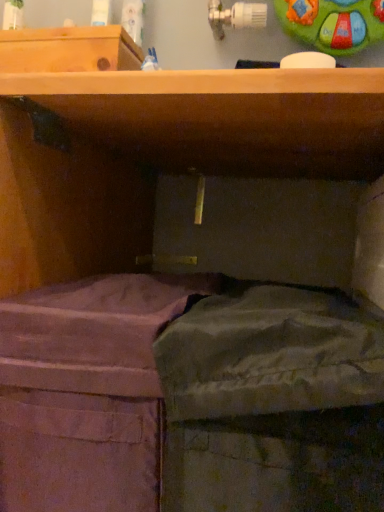
This screenshot has height=512, width=384. Describe the element at coordinates (86, 391) in the screenshot. I see `pink fabric at lower left, the 2th wide viewed from the right` at that location.

Find the location of a particular element. pink fabric at lower left, the 2th wide viewed from the right is located at coordinates (86, 391).

Where is `green crumpled paper at lower right, the first wide in the right-to-left sequence`? This screenshot has height=512, width=384. green crumpled paper at lower right, the first wide in the right-to-left sequence is located at coordinates (272, 404).

Image resolution: width=384 pixels, height=512 pixels. What do you see at coordinates (272, 404) in the screenshot?
I see `green crumpled paper at lower right, which is the 2th wide in left-to-right order` at bounding box center [272, 404].

Locate an element on the screen. The image size is (384, 512). pink fabric at lower left, the 2th wide viewed from the right is located at coordinates (86, 391).

Which object is positioned more to the right, green crumpled paper at lower right, which is the 2th wide in left-to-right order, or pink fabric at lower left, which is the 1th wide from left to right?

Positioned to the right is green crumpled paper at lower right, which is the 2th wide in left-to-right order.

Looking at this image, which object is further away from the camera, green crumpled paper at lower right, the first wide in the right-to-left sequence, or pink fabric at lower left, the 2th wide viewed from the right?

pink fabric at lower left, the 2th wide viewed from the right, is further away from the camera.

Is point (264, 416) farther from camera compared to point (138, 381)?

No.

From the image's perspective, would you say green crumpled paper at lower right, which is the 2th wide in left-to-right order, is positioned over pink fabric at lower left, which is the 1th wide from left to right?

Yes, from the image's perspective, green crumpled paper at lower right, which is the 2th wide in left-to-right order, is on top of pink fabric at lower left, which is the 1th wide from left to right.

From a real-world perspective, is green crumpled paper at lower right, the first wide in the right-to-left sequence, under pink fabric at lower left, the 2th wide viewed from the right?

No, from a real-world perspective, green crumpled paper at lower right, the first wide in the right-to-left sequence, is not beneath pink fabric at lower left, the 2th wide viewed from the right.

Can you confirm if green crumpled paper at lower right, the first wide in the right-to-left sequence, is wider than pink fabric at lower left, which is the 1th wide from left to right?

Yes, green crumpled paper at lower right, the first wide in the right-to-left sequence, is wider than pink fabric at lower left, which is the 1th wide from left to right.

Which of these two, green crumpled paper at lower right, which is the 2th wide in left-to-right order, or pink fabric at lower left, which is the 1th wide from left to right, stands shorter?

green crumpled paper at lower right, which is the 2th wide in left-to-right order, is shorter.

Between green crumpled paper at lower right, which is the 2th wide in left-to-right order, and pink fabric at lower left, the 2th wide viewed from the right, which one has larger size?

Bigger between the two is pink fabric at lower left, the 2th wide viewed from the right.

Based on the photo, can pink fabric at lower left, the 2th wide viewed from the right, be found inside green crumpled paper at lower right, which is the 2th wide in left-to-right order?

No, green crumpled paper at lower right, which is the 2th wide in left-to-right order, does not contain pink fabric at lower left, the 2th wide viewed from the right.

Is green crumpled paper at lower right, the first wide in the right-to-left sequence, facing towards pink fabric at lower left, which is the 1th wide from left to right?

No, green crumpled paper at lower right, the first wide in the right-to-left sequence, is not facing towards pink fabric at lower left, which is the 1th wide from left to right.

The height and width of the screenshot is (512, 384). Find the location of `wide below the green crumpled paper at lower right, which is the 2th wide in left-to-right order (from a real-world perspective)`. wide below the green crumpled paper at lower right, which is the 2th wide in left-to-right order (from a real-world perspective) is located at coordinates (86, 391).

Considering the relative positions of pink fabric at lower left, which is the 1th wide from left to right, and green crumpled paper at lower right, the first wide in the right-to-left sequence, in the image provided, is pink fabric at lower left, which is the 1th wide from left to right, to the left or to the right of green crumpled paper at lower right, the first wide in the right-to-left sequence,?

In the image, pink fabric at lower left, which is the 1th wide from left to right, appears on the left side of green crumpled paper at lower right, the first wide in the right-to-left sequence.

Is pink fabric at lower left, the 2th wide viewed from the right, in front of or behind green crumpled paper at lower right, the first wide in the right-to-left sequence, in the image?

pink fabric at lower left, the 2th wide viewed from the right, is behind green crumpled paper at lower right, the first wide in the right-to-left sequence.

Considering the positions of points (75, 473) and (330, 312), is point (75, 473) farther from camera compared to point (330, 312)?

That is True.

From the image's perspective, between pink fabric at lower left, the 2th wide viewed from the right, and green crumpled paper at lower right, which is the 2th wide in left-to-right order, which one is located above?

green crumpled paper at lower right, which is the 2th wide in left-to-right order.

From a real-world perspective, is pink fabric at lower left, the 2th wide viewed from the right, positioned under green crumpled paper at lower right, the first wide in the right-to-left sequence, based on gravity?

Indeed, from a real-world perspective, pink fabric at lower left, the 2th wide viewed from the right, is positioned beneath green crumpled paper at lower right, the first wide in the right-to-left sequence.

Which object is wider, pink fabric at lower left, which is the 1th wide from left to right, or green crumpled paper at lower right, the first wide in the right-to-left sequence?

Wider between the two is green crumpled paper at lower right, the first wide in the right-to-left sequence.

Which of these two, pink fabric at lower left, which is the 1th wide from left to right, or green crumpled paper at lower right, the first wide in the right-to-left sequence, stands taller?

pink fabric at lower left, which is the 1th wide from left to right, is taller.

Based on their sizes in the image, would you say pink fabric at lower left, the 2th wide viewed from the right, is bigger or smaller than green crumpled paper at lower right, which is the 2th wide in left-to-right order?

Clearly, pink fabric at lower left, the 2th wide viewed from the right, is larger in size than green crumpled paper at lower right, which is the 2th wide in left-to-right order.

Is pink fabric at lower left, the 2th wide viewed from the right, spatially inside green crumpled paper at lower right, which is the 2th wide in left-to-right order, or outside of it?

pink fabric at lower left, the 2th wide viewed from the right, exists outside the volume of green crumpled paper at lower right, which is the 2th wide in left-to-right order.

Is pink fabric at lower left, the 2th wide viewed from the right, far from green crumpled paper at lower right, which is the 2th wide in left-to-right order?

No, pink fabric at lower left, the 2th wide viewed from the right, is not far from green crumpled paper at lower right, which is the 2th wide in left-to-right order.

Does pink fabric at lower left, the 2th wide viewed from the right, turn towards green crumpled paper at lower right, the first wide in the right-to-left sequence?

No, pink fabric at lower left, the 2th wide viewed from the right, is not aimed at green crumpled paper at lower right, the first wide in the right-to-left sequence.

What's the angular difference between pink fabric at lower left, the 2th wide viewed from the right, and green crumpled paper at lower right, the first wide in the right-to-left sequence,'s facing directions?

The angular difference between pink fabric at lower left, the 2th wide viewed from the right, and green crumpled paper at lower right, the first wide in the right-to-left sequence, is 2.35 degrees.

Measure the distance from pink fabric at lower left, the 2th wide viewed from the right, to green crumpled paper at lower right, which is the 2th wide in left-to-right order.

pink fabric at lower left, the 2th wide viewed from the right, and green crumpled paper at lower right, which is the 2th wide in left-to-right order, are 4.09 inches apart from each other.

You are a GUI agent. You are given a task and a screenshot of the screen. Output one action in this format:
    pyautogui.click(x=<x>, y=<y>)
    Task: Click on the wide located behind the green crumpled paper at lower right, the first wide in the right-to-left sequence
    The height and width of the screenshot is (512, 384).
    Given the screenshot: What is the action you would take?
    pyautogui.click(x=86, y=391)

What are the coordinates of `wide that appears below the green crumpled paper at lower right, which is the 2th wide in left-to-right order (from the image's perspective)` in the screenshot? It's located at (86, 391).

Identify the location of wide that appears below the green crumpled paper at lower right, which is the 2th wide in left-to-right order (from a real-world perspective). (86, 391).